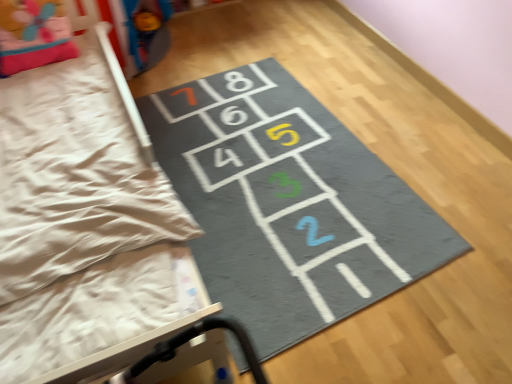
Question: From the image's perspective, is pink fabric pillow at upper left located beneath gray fabric hopscotch at center?

Choices:
 (A) no
 (B) yes

Answer: (A)

Question: Does pink fabric pillow at upper left have a smaller size compared to gray fabric hopscotch at center?

Choices:
 (A) no
 (B) yes

Answer: (B)

Question: Can you confirm if pink fabric pillow at upper left is taller than gray fabric hopscotch at center?

Choices:
 (A) yes
 (B) no

Answer: (A)

Question: Considering the relative sizes of pink fabric pillow at upper left and gray fabric hopscotch at center in the image provided, is pink fabric pillow at upper left thinner than gray fabric hopscotch at center?

Choices:
 (A) yes
 (B) no

Answer: (A)

Question: Can you confirm if pink fabric pillow at upper left is wider than gray fabric hopscotch at center?

Choices:
 (A) no
 (B) yes

Answer: (A)

Question: Is pink fabric pillow at upper left at the left side of gray fabric hopscotch at center?

Choices:
 (A) no
 (B) yes

Answer: (B)

Question: Can you confirm if gray fabric hopscotch at center is positioned to the left of pink fabric pillow at upper left?

Choices:
 (A) yes
 (B) no

Answer: (B)

Question: Does gray fabric hopscotch at center have a larger size compared to pink fabric pillow at upper left?

Choices:
 (A) yes
 (B) no

Answer: (A)

Question: Is gray fabric hopscotch at center aimed at pink fabric pillow at upper left?

Choices:
 (A) yes
 (B) no

Answer: (B)

Question: From the image's perspective, does gray fabric hopscotch at center appear lower than pink fabric pillow at upper left?

Choices:
 (A) yes
 (B) no

Answer: (A)

Question: Is gray fabric hopscotch at center completely or partially outside of pink fabric pillow at upper left?

Choices:
 (A) no
 (B) yes

Answer: (B)

Question: Considering the relative sizes of gray fabric hopscotch at center and pink fabric pillow at upper left in the image provided, is gray fabric hopscotch at center wider than pink fabric pillow at upper left?

Choices:
 (A) yes
 (B) no

Answer: (A)

Question: Is pink fabric pillow at upper left in front of or behind gray fabric hopscotch at center in the image?

Choices:
 (A) front
 (B) behind

Answer: (B)